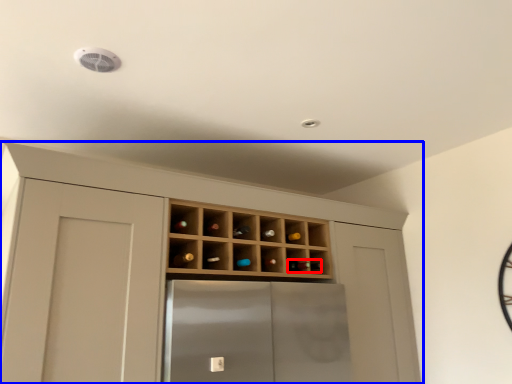
Question: Which of the following is the closest to the observer, wine bottle (highlighted by a red box) or cupboard (highlighted by a blue box)?

Choices:
 (A) wine bottle
 (B) cupboard

Answer: (B)